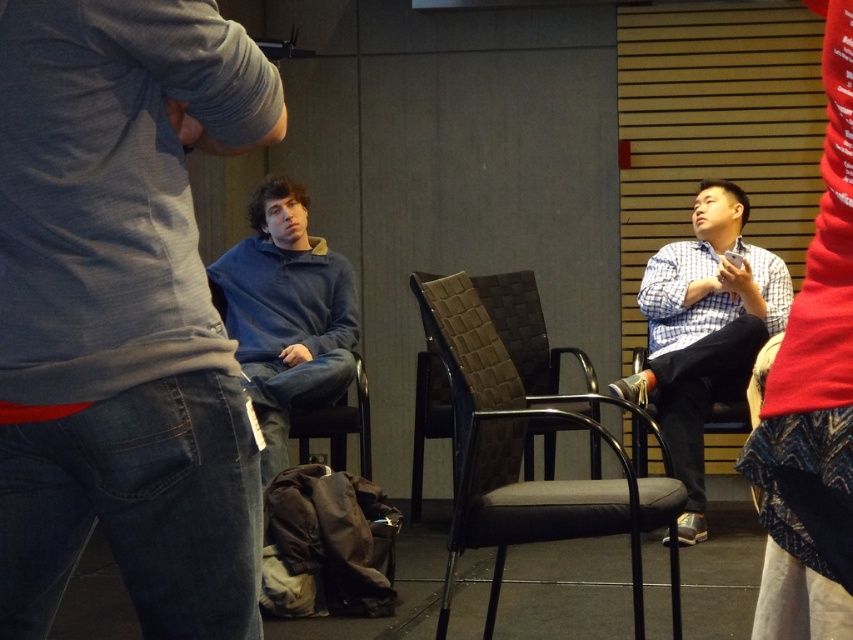
Between checkered fabric shirt at right and blue fleece at center, which one is positioned higher?

blue fleece at center is higher up.

Does checkered fabric shirt at right lie in front of blue fleece at center?

No, it is behind blue fleece at center.

This screenshot has width=853, height=640. Identify the location of checkered fabric shirt at right. (704, 332).

Where is `checkered fabric shirt at right`? Image resolution: width=853 pixels, height=640 pixels. checkered fabric shirt at right is located at coordinates (704, 332).

Does blue cotton sweater at center have a greater width compared to black woven fabric chair at center?

Incorrect, blue cotton sweater at center's width does not surpass black woven fabric chair at center's.

Between blue cotton sweater at center and black woven fabric chair at center, which one is positioned higher?

blue cotton sweater at center is higher up.

Who is more distant from viewer, (90, 109) or (676, 579)?

Positioned behind is point (676, 579).

You are a GUI agent. You are given a task and a screenshot of the screen. Output one action in this format:
    pyautogui.click(x=<x>, y=<y>)
    Task: Click on the blue cotton sweater at center
    
    Given the screenshot: What is the action you would take?
    pyautogui.click(x=122, y=312)

What do you see at coordinates (122, 312) in the screenshot? The height and width of the screenshot is (640, 853). I see `blue cotton sweater at center` at bounding box center [122, 312].

Is blue cotton sweater at center above brown woven chair at center?

Correct, blue cotton sweater at center is located above brown woven chair at center.

The height and width of the screenshot is (640, 853). I want to click on blue cotton sweater at center, so click(x=122, y=312).